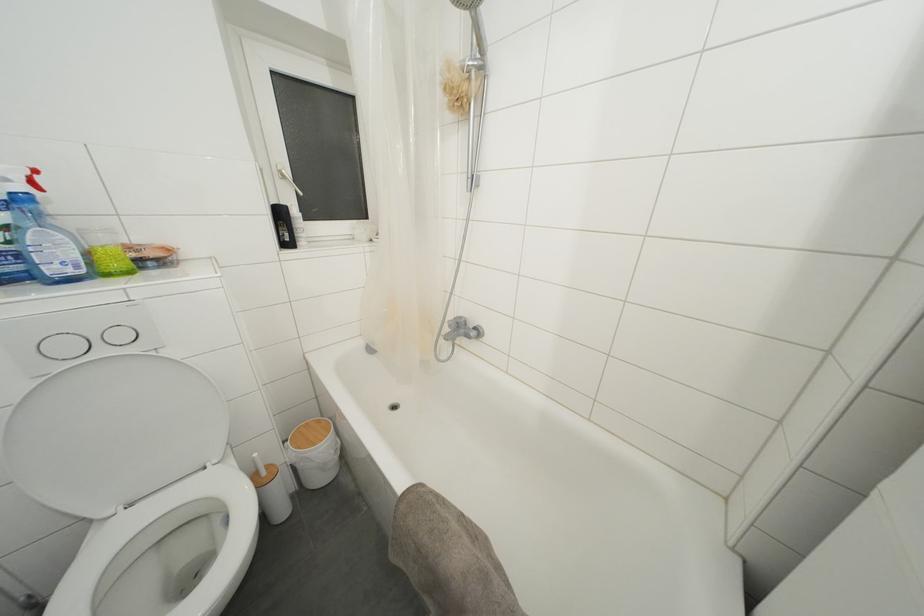
The image size is (924, 616). I want to click on red spray trigger, so click(x=33, y=179).